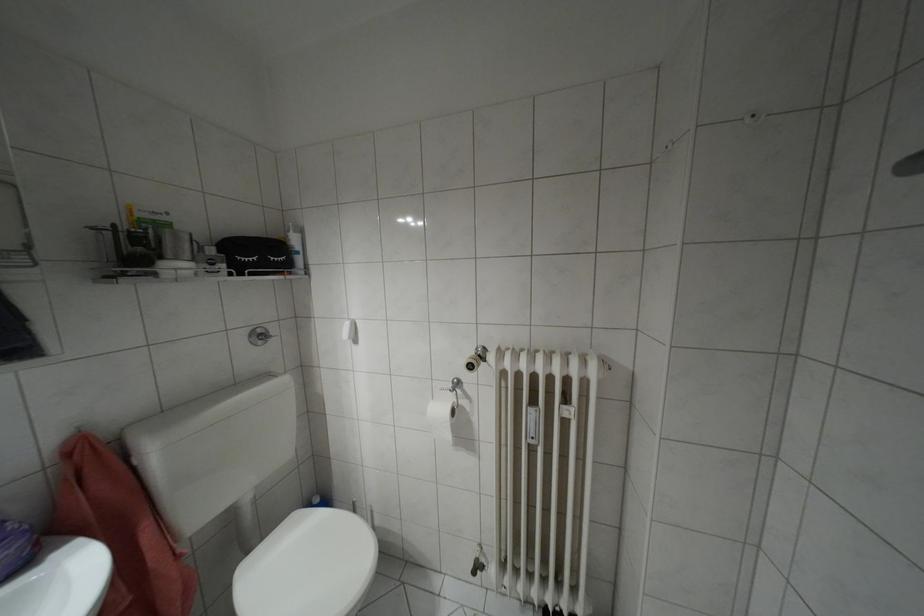
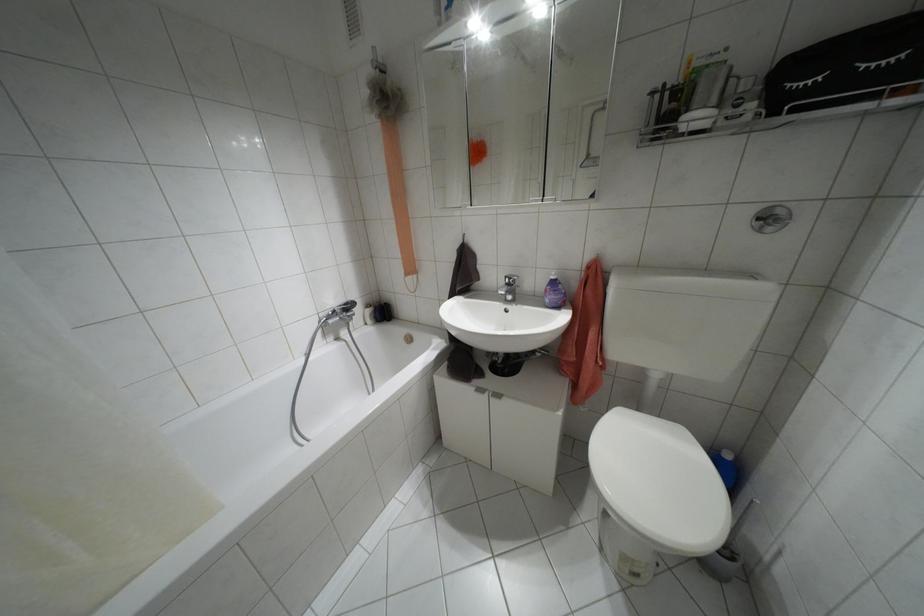
In the second image, find the point that corresponds to pixel 239 274 in the first image.

(773, 113)